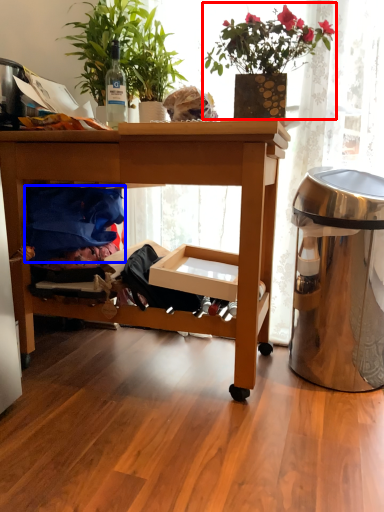
Question: Which of the following is the farthest to the observer, houseplant (highlighted by a red box) or clothing (highlighted by a blue box)?

Choices:
 (A) houseplant
 (B) clothing

Answer: (B)